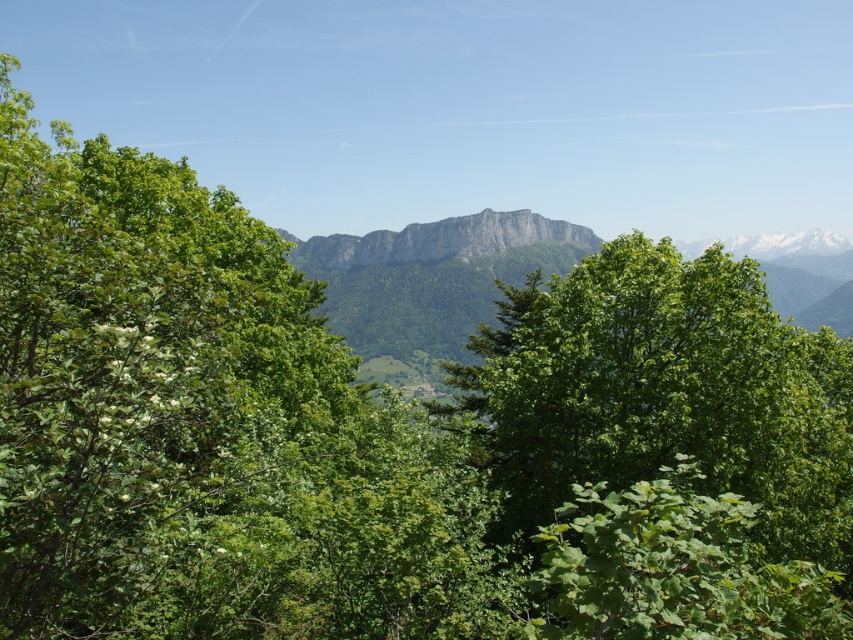
Question: Which object is farther from the camera taking this photo?

Choices:
 (A) gray rocky mountain range at center
 (B) green leafy tree at center

Answer: (A)

Question: Is green leafy tree at center wider than gray rocky mountain range at center?

Choices:
 (A) yes
 (B) no

Answer: (B)

Question: Among these objects, which one is nearest to the camera?

Choices:
 (A) gray rocky mountain range at center
 (B) green leafy tree at center

Answer: (B)

Question: Observing the image, what is the correct spatial positioning of green leafy tree at center in reference to gray rocky mountain range at center?

Choices:
 (A) below
 (B) above

Answer: (A)

Question: Can you confirm if green leafy tree at center is positioned below gray rocky mountain range at center?

Choices:
 (A) yes
 (B) no

Answer: (A)